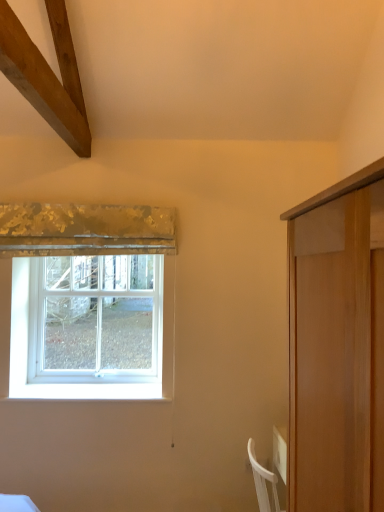
This screenshot has width=384, height=512. In order to click on gold textured fabric at upper left in this screenshot , I will do `click(85, 230)`.

This screenshot has width=384, height=512. Describe the element at coordinates (85, 230) in the screenshot. I see `gold textured fabric at upper left` at that location.

The width and height of the screenshot is (384, 512). What do you see at coordinates (98, 315) in the screenshot?
I see `white plastic window at left` at bounding box center [98, 315].

Locate an element on the screen. The image size is (384, 512). white plastic window at left is located at coordinates tap(98, 315).

Where is `gold textured fabric at upper left`? gold textured fabric at upper left is located at coordinates (85, 230).

In the scene shown: Is gold textured fabric at upper left to the right of white plastic window at left from the viewer's perspective?

Yes.

Which object is closer to the camera taking this photo, gold textured fabric at upper left or white plastic window at left?

gold textured fabric at upper left is closer to the camera.

Between point (92, 238) and point (78, 356), which one is positioned behind?

Positioned behind is point (78, 356).

From the image's perspective, which is above, gold textured fabric at upper left or white plastic window at left?

From the image's view, gold textured fabric at upper left is above.

Consider the image. From a real-world perspective, between gold textured fabric at upper left and white plastic window at left, who is vertically higher?

In real-world perspective, gold textured fabric at upper left is above.

Can you confirm if gold textured fabric at upper left is wider than white plastic window at left?

Yes, gold textured fabric at upper left is wider than white plastic window at left.

Which of these two, gold textured fabric at upper left or white plastic window at left, stands shorter?

gold textured fabric at upper left is shorter.

Can you confirm if gold textured fabric at upper left is smaller than white plastic window at left?

Yes.

Is gold textured fabric at upper left inside the boundaries of white plastic window at left, or outside?

gold textured fabric at upper left lies outside white plastic window at left.

Is gold textured fabric at upper left next to white plastic window at left?

No, gold textured fabric at upper left is not beside white plastic window at left.

Is white plastic window at left at the back of gold textured fabric at upper left?

No, white plastic window at left is not at the back of gold textured fabric at upper left.

I want to click on window on the left side of gold textured fabric at upper left, so click(x=98, y=315).

Considering the relative positions of white plastic window at left and gold textured fabric at upper left in the image provided, is white plastic window at left to the left or to the right of gold textured fabric at upper left?

Clearly, white plastic window at left is on the left of gold textured fabric at upper left in the image.

Does white plastic window at left come in front of gold textured fabric at upper left?

No, white plastic window at left is further to the viewer.

Is point (42, 330) closer or farther from the camera than point (64, 242)?

Point (42, 330) is farther from the camera than point (64, 242).

From the image's perspective, is white plastic window at left positioned above or below gold textured fabric at upper left?

white plastic window at left is below gold textured fabric at upper left.

From a real-world perspective, does white plastic window at left stand above gold textured fabric at upper left?

No.

Looking at their sizes, would you say white plastic window at left is wider or thinner than gold textured fabric at upper left?

In the image, white plastic window at left appears to be more narrow than gold textured fabric at upper left.

Can you confirm if white plastic window at left is shorter than gold textured fabric at upper left?

In fact, white plastic window at left may be taller than gold textured fabric at upper left.

Considering the sizes of objects white plastic window at left and gold textured fabric at upper left in the image provided, who is bigger, white plastic window at left or gold textured fabric at upper left?

With larger size is white plastic window at left.

Is white plastic window at left not inside gold textured fabric at upper left?

white plastic window at left lies outside gold textured fabric at upper left's area.

Is white plastic window at left next to gold textured fabric at upper left?

No, white plastic window at left is not touching gold textured fabric at upper left.

Is white plastic window at left oriented towards gold textured fabric at upper left?

No, white plastic window at left is not oriented towards gold textured fabric at upper left.

Can you tell me how much white plastic window at left and gold textured fabric at upper left differ in facing direction?

white plastic window at left and gold textured fabric at upper left are facing 1.62 degrees away from each other.

Consider the image. Measure the distance from white plastic window at left to gold textured fabric at upper left.

white plastic window at left is 22.19 inches from gold textured fabric at upper left.

The width and height of the screenshot is (384, 512). Find the location of `window that appears behind the gold textured fabric at upper left`. window that appears behind the gold textured fabric at upper left is located at coordinates (98, 315).

Find the location of a particular element. window that is under the gold textured fabric at upper left (from a real-world perspective) is located at coordinates (98, 315).

The width and height of the screenshot is (384, 512). Identify the location of curtain on the right of white plastic window at left. (85, 230).